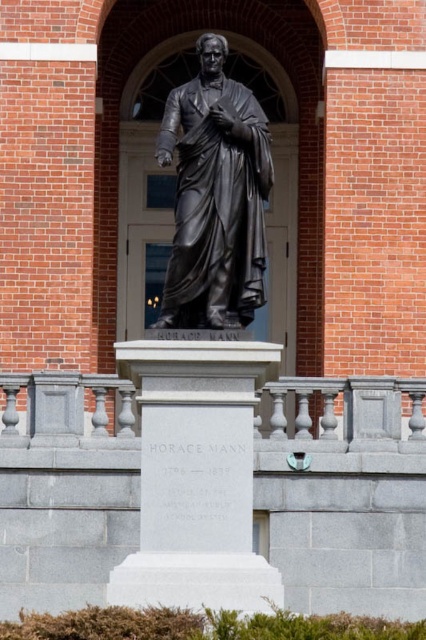
You are standing at the entrance of the red brick building and want to find the white marble pedestal at center. According to the coordinates provided, where should you look relative to the building?

The white marble pedestal at center is located at coordinates point (196, 476), which means it is positioned to the right and slightly above the center point relative to the building.

You are standing in front of the red brick building with the Horace Mann statue. There are two points marked on the ground near the statue. The first point is at coordinates point (181, 492) and the second point is at point (227, 259). If you are facing the building, which point is closer to the statue?

Point (181, 492) is in front of point (227, 259), so when facing the building, point (181, 492) is closer to the statue.